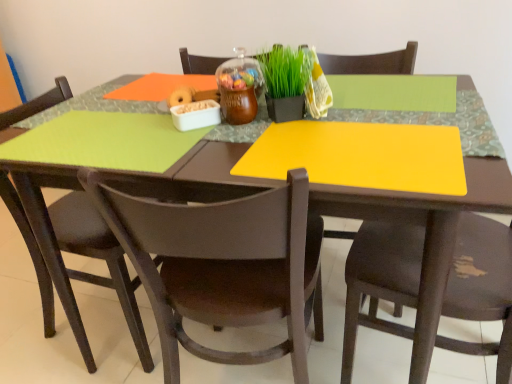
Question: Does point (244, 352) appear closer or farther from the camera than point (463, 311)?

Choices:
 (A) closer
 (B) farther

Answer: (B)

Question: Is brown plastic chair at center, the 2th chair viewed from the left, wider or thinner than matte brown chair at lower right, placed as the 1th chair when sorted from right to left?

Choices:
 (A) thin
 (B) wide

Answer: (B)

Question: Which of these objects is positioned closest to the matte brown chair at lower right, placed as the 1th chair when sorted from right to left?

Choices:
 (A) green matte plant at center
 (B) brown plastic chair at center, placed as the 2th chair when sorted from right to left
 (C) matte brown chair at lower left, which is the 3th chair from right to left

Answer: (B)

Question: Which object is positioned closest to the brown plastic chair at center, placed as the 2th chair when sorted from right to left?

Choices:
 (A) green matte plant at center
 (B) matte brown chair at lower right, the 3th chair in the left-to-right sequence
 (C) matte brown chair at lower left, which is the 3th chair from right to left

Answer: (B)